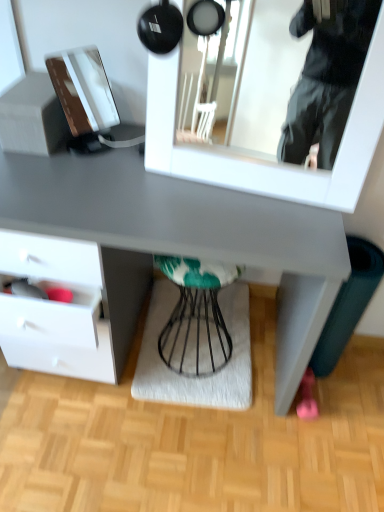
Question: From the image's perspective, is textured gray mat at center under white glossy mirror at upper center?

Choices:
 (A) yes
 (B) no

Answer: (A)

Question: Would you say textured gray mat at center is outside white glossy mirror at upper center?

Choices:
 (A) yes
 (B) no

Answer: (A)

Question: Can you see textured gray mat at center touching white glossy mirror at upper center?

Choices:
 (A) yes
 (B) no

Answer: (B)

Question: Does textured gray mat at center lie in front of white glossy mirror at upper center?

Choices:
 (A) no
 (B) yes

Answer: (A)

Question: Is textured gray mat at center facing away from white glossy mirror at upper center?

Choices:
 (A) yes
 (B) no

Answer: (B)

Question: Can you confirm if textured gray mat at center is smaller than white glossy mirror at upper center?

Choices:
 (A) yes
 (B) no

Answer: (A)

Question: Is white glossy mirror at upper center far from matte gray desk at center?

Choices:
 (A) yes
 (B) no

Answer: (B)

Question: Is white glossy mirror at upper center outside matte gray desk at center?

Choices:
 (A) yes
 (B) no

Answer: (A)

Question: Does white glossy mirror at upper center have a smaller size compared to matte gray desk at center?

Choices:
 (A) yes
 (B) no

Answer: (A)

Question: From the image's perspective, would you say white glossy mirror at upper center is shown under matte gray desk at center?

Choices:
 (A) yes
 (B) no

Answer: (B)

Question: Is white glossy mirror at upper center positioned with its back to matte gray desk at center?

Choices:
 (A) yes
 (B) no

Answer: (B)

Question: Does white glossy mirror at upper center have a lesser width compared to matte gray desk at center?

Choices:
 (A) yes
 (B) no

Answer: (A)

Question: Considering the relative positions of white glossy mirror at upper center and textured gray mat at center in the image provided, is white glossy mirror at upper center behind textured gray mat at center?

Choices:
 (A) yes
 (B) no

Answer: (B)